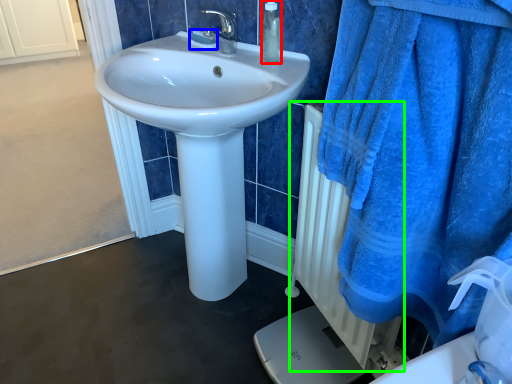
Question: Which is nearer to the soap dispenser (highlighted by a red box)? soap (highlighted by a blue box) or radiator (highlighted by a green box).

Choices:
 (A) soap
 (B) radiator

Answer: (A)